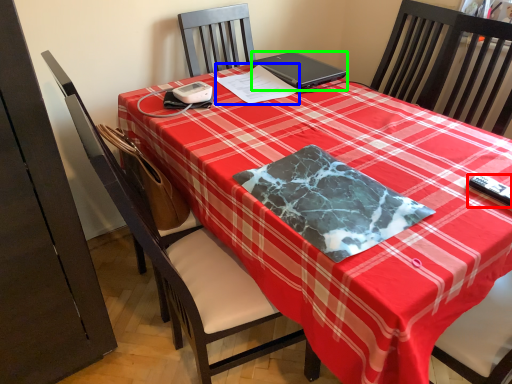
Question: Estimate the real-world distances between objects in this image. Which object is farther from remote control (highlighted by a red box), notepad (highlighted by a blue box) or laptop (highlighted by a green box)?

Choices:
 (A) notepad
 (B) laptop

Answer: (B)